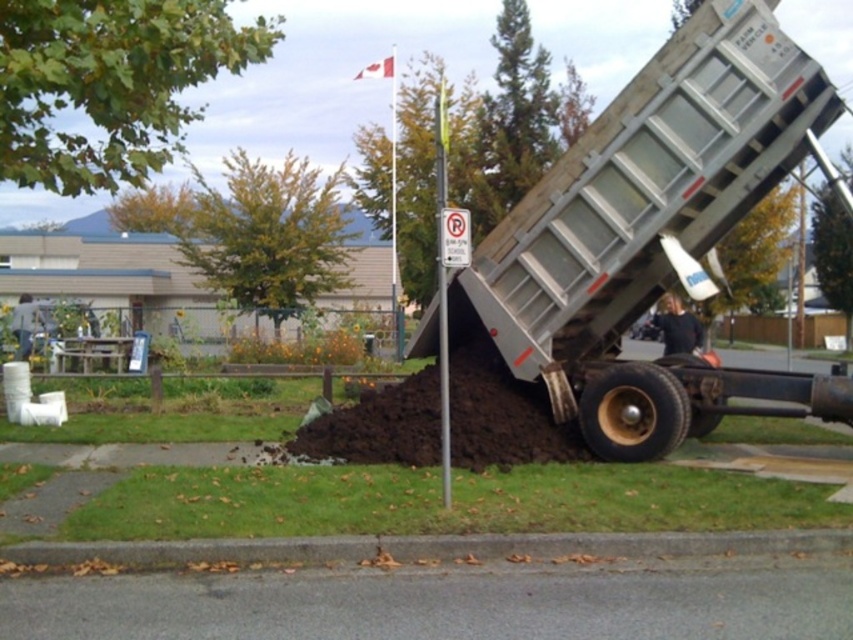
Between yellow-green foliage at upper center and dark brown soil at center, which one has less height?

With less height is dark brown soil at center.

Who is more forward, (x=328, y=240) or (x=473, y=440)?

Positioned in front is point (x=473, y=440).

At what (x,y) coordinates should I click in order to perform the action: click on yellow-green foliage at upper center. Please return your answer as a coordinate pair (x, y). The height and width of the screenshot is (640, 853). Looking at the image, I should click on (268, 236).

Is point (259, 292) in front of point (405, 148)?

Yes, it is.

In the scene shown: Can you confirm if yellow-green foliage at upper center is wider than green leafy tree at upper center?

Indeed, yellow-green foliage at upper center has a greater width compared to green leafy tree at upper center.

What do you see at coordinates (268, 236) in the screenshot? This screenshot has width=853, height=640. I see `yellow-green foliage at upper center` at bounding box center [268, 236].

Find the location of a particular element. yellow-green foliage at upper center is located at coordinates pos(268,236).

What do you see at coordinates (427, 547) in the screenshot?
I see `gray concrete curb at lower center` at bounding box center [427, 547].

Is the position of gray concrete curb at lower center more distant than that of green leafy tree at upper center?

That is False.

Locate an element on the screen. gray concrete curb at lower center is located at coordinates (427, 547).

At what (x,y) coordinates should I click in order to perform the action: click on gray concrete curb at lower center. Please return your answer as a coordinate pair (x, y). Looking at the image, I should click on (427, 547).